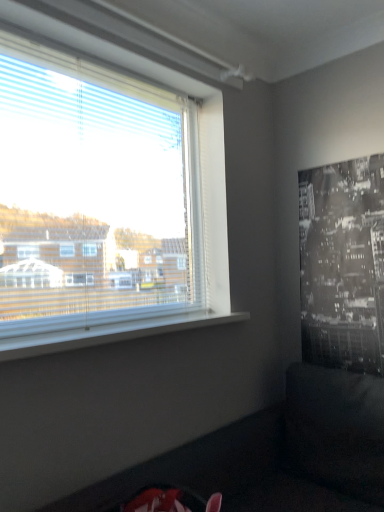
What is the approximate height of dark fabric couch at lower right?

It is 30.85 inches.

At what (x,y) coordinates should I click in order to perform the action: click on dark fabric couch at lower right. Please return your answer as a coordinate pair (x, y). Looking at the image, I should click on (273, 455).

The width and height of the screenshot is (384, 512). What do you see at coordinates (273, 455) in the screenshot? I see `dark fabric couch at lower right` at bounding box center [273, 455].

The width and height of the screenshot is (384, 512). Identify the location of dark fabric couch at lower right. (273, 455).